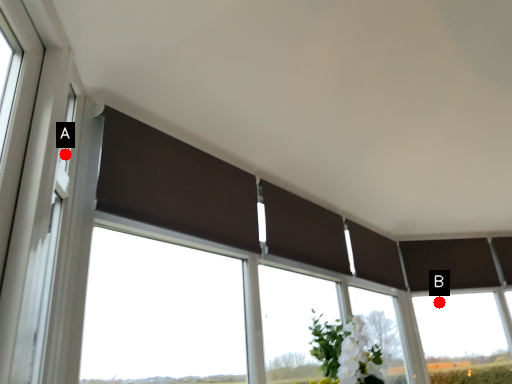
Question: Two points are circled on the image, labeled by A and B beside each circle. Which point is further to the camera?

Choices:
 (A) A is further
 (B) B is further

Answer: (B)